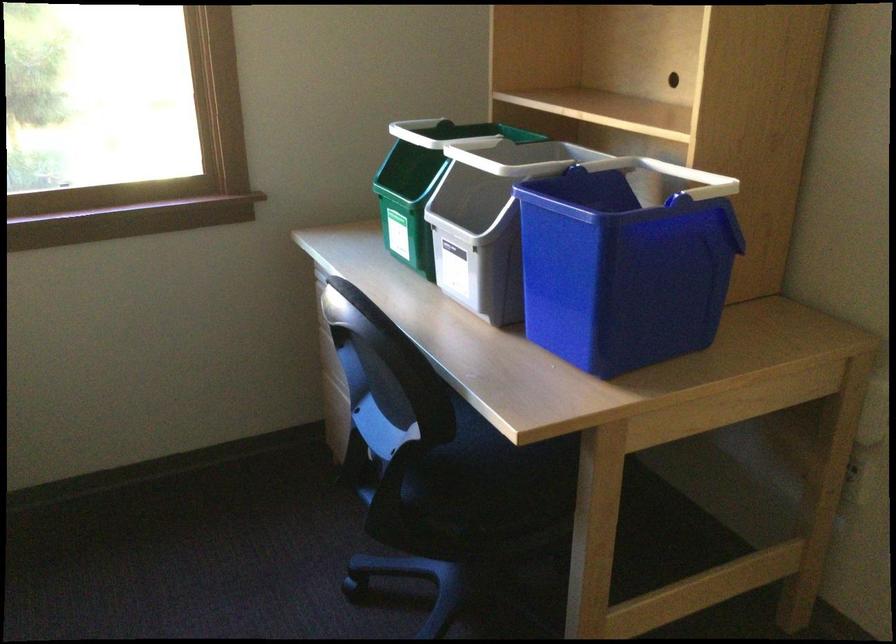
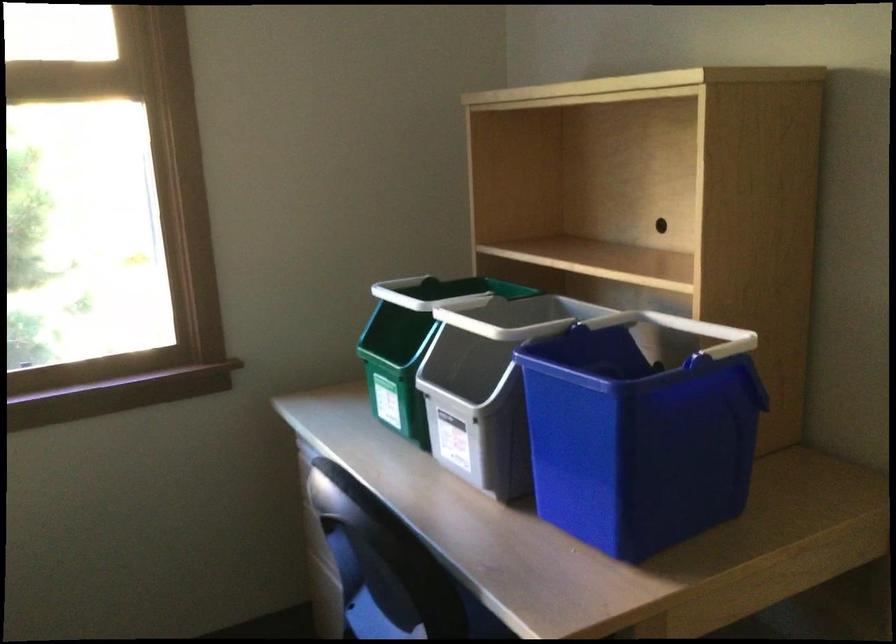
Question: What movement of the cameraman would produce the second image?

Choices:
 (A) Left
 (B) Right
 (C) Forward
 (D) Backward

Answer: (C)